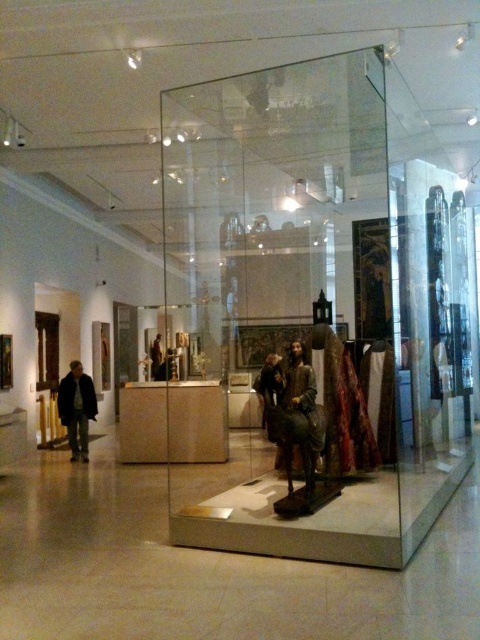
Question: Which of the following is the farthest from the observer?

Choices:
 (A) (266, 372)
 (B) (84, 417)
 (C) (285, 416)

Answer: (A)

Question: Does transparent glass box at center have a larger size compared to dark brown leather jacket at lower left?

Choices:
 (A) yes
 (B) no

Answer: (A)

Question: Is dark brown leather jacket at lower left closer to camera compared to dark brown leather jacket at center?

Choices:
 (A) no
 (B) yes

Answer: (B)

Question: Is transparent glass box at center smaller than dark brown leather jacket at lower left?

Choices:
 (A) yes
 (B) no

Answer: (B)

Question: Which point is closer to the camera taking this photo?

Choices:
 (A) (80, 378)
 (B) (213, 461)
 (C) (255, 381)

Answer: (B)

Question: Which object is positioned closest to the smooth brown statue at center?

Choices:
 (A) dark brown leather jacket at center
 (B) transparent glass box at center
 (C) dark brown leather jacket at lower left

Answer: (B)